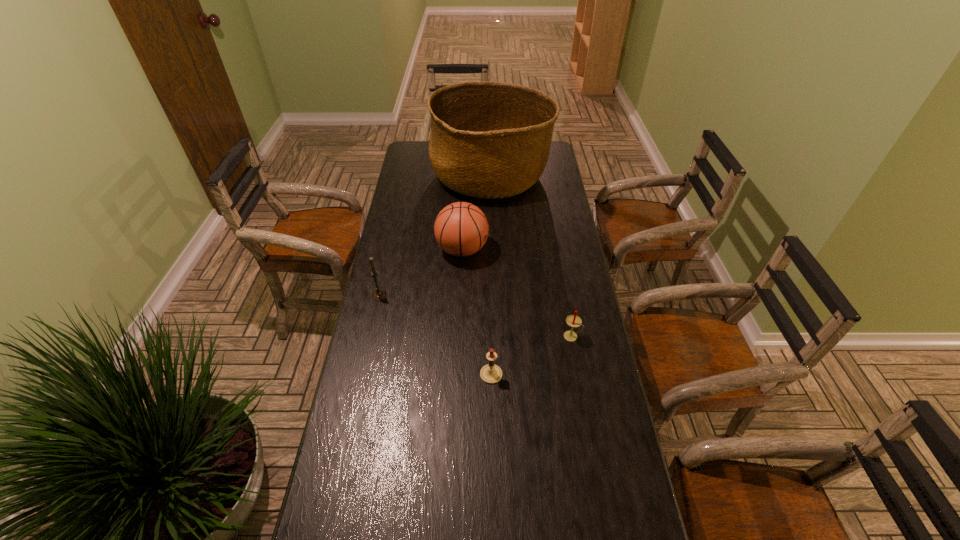
Where is `object that is at the far right corner`? object that is at the far right corner is located at coordinates (489, 140).

This screenshot has height=540, width=960. Identify the location of free space at the left edge of the desktop. (360, 401).

Find the location of a particular element. The width and height of the screenshot is (960, 540). free location at the right edge is located at coordinates (587, 324).

You are a GUI agent. You are given a task and a screenshot of the screen. Output one action in this format:
    pyautogui.click(x=<x>, y=<y>)
    Task: Click on the free spot at the far left corner of the desktop
    This screenshot has width=960, height=540.
    Given the screenshot: What is the action you would take?
    pyautogui.click(x=409, y=152)

Where is `free point between the farthest candle and the tallest object`? free point between the farthest candle and the tallest object is located at coordinates (435, 236).

Find the location of `free point between the nearest candle and the tallest object`. free point between the nearest candle and the tallest object is located at coordinates (491, 275).

Find the location of a particular element. The width and height of the screenshot is (960, 540). free space between the nearest candle and the leftmost candle is located at coordinates tap(435, 335).

Identify the location of free space between the nearest object and the tallest object. (491, 275).

At what (x,y) coordinates should I click in order to perform the action: click on empty location between the farthest object and the second farthest candle. Please return your answer as a coordinate pair (x, y). Image resolution: width=960 pixels, height=540 pixels. Looking at the image, I should click on (531, 256).

Image resolution: width=960 pixels, height=540 pixels. Identify the location of vacant region between the nearest candle and the rightmost candle. (532, 355).